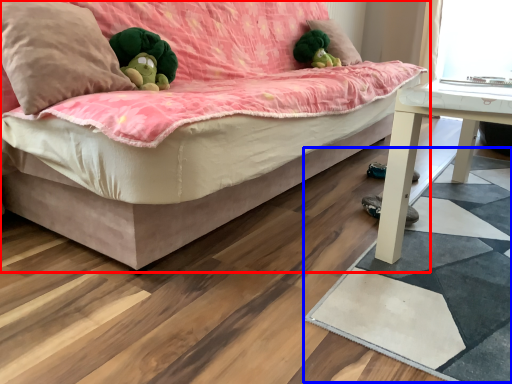
Question: Which point is further to the camera, studio couch (highlighted by a red box) or mat (highlighted by a blue box)?

Choices:
 (A) studio couch
 (B) mat

Answer: (B)